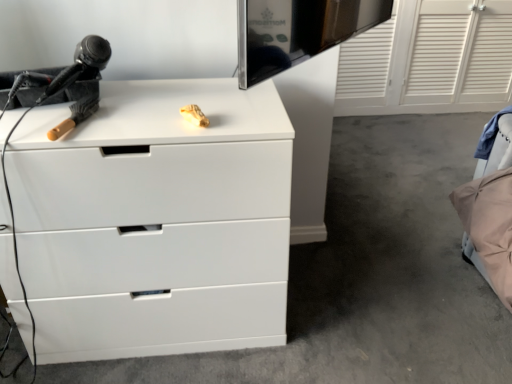
Question: Is white matte chest of drawers at center located within black plastic hairdryer at left?

Choices:
 (A) no
 (B) yes

Answer: (A)

Question: Are black plastic hairdryer at left and white matte chest of drawers at center making contact?

Choices:
 (A) no
 (B) yes

Answer: (A)

Question: From a real-world perspective, is black plastic hairdryer at left positioned under white matte chest of drawers at center based on gravity?

Choices:
 (A) no
 (B) yes

Answer: (A)

Question: From a real-world perspective, is black plastic hairdryer at left on white matte chest of drawers at center?

Choices:
 (A) yes
 (B) no

Answer: (A)

Question: Considering the relative sizes of black plastic hairdryer at left and white matte chest of drawers at center in the image provided, is black plastic hairdryer at left smaller than white matte chest of drawers at center?

Choices:
 (A) no
 (B) yes

Answer: (B)

Question: Looking at the image, does white matte chest of drawers at center seem bigger or smaller compared to beige fabric bed at lower right?

Choices:
 (A) big
 (B) small

Answer: (A)

Question: Would you say white matte chest of drawers at center is to the left or to the right of beige fabric bed at lower right in the picture?

Choices:
 (A) left
 (B) right

Answer: (A)

Question: Is white matte chest of drawers at center taller or shorter than beige fabric bed at lower right?

Choices:
 (A) tall
 (B) short

Answer: (A)

Question: Is point (138, 190) positioned closer to the camera than point (492, 203)?

Choices:
 (A) closer
 (B) farther

Answer: (A)

Question: From a real-world perspective, is beige fabric bed at lower right physically located above or below black plastic hairdryer at left?

Choices:
 (A) above
 (B) below

Answer: (B)

Question: Looking at the image, does beige fabric bed at lower right seem bigger or smaller compared to black plastic hairdryer at left?

Choices:
 (A) big
 (B) small

Answer: (A)

Question: In terms of width, does beige fabric bed at lower right look wider or thinner when compared to black plastic hairdryer at left?

Choices:
 (A) thin
 (B) wide

Answer: (B)

Question: Do you think beige fabric bed at lower right is within black plastic hairdryer at left, or outside of it?

Choices:
 (A) inside
 (B) outside

Answer: (B)

Question: From the image's perspective, is white matte chest of drawers at center positioned above or below black plastic hairdryer at left?

Choices:
 (A) above
 (B) below

Answer: (B)

Question: Is white matte chest of drawers at center inside the boundaries of black plastic hairdryer at left, or outside?

Choices:
 (A) outside
 (B) inside

Answer: (A)